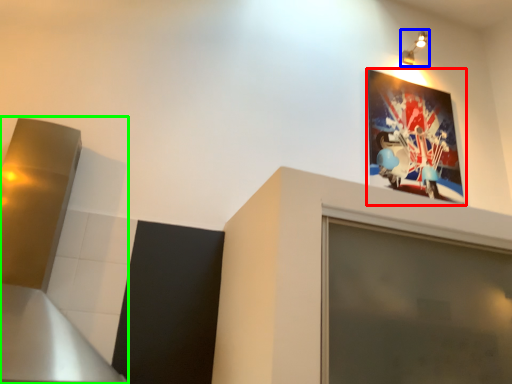
Question: Estimate the real-world distances between objects in this image. Which object is closer to picture frame (highlighted by a red box), light fixture (highlighted by a blue box) or exhaust hood (highlighted by a green box)?

Choices:
 (A) light fixture
 (B) exhaust hood

Answer: (A)